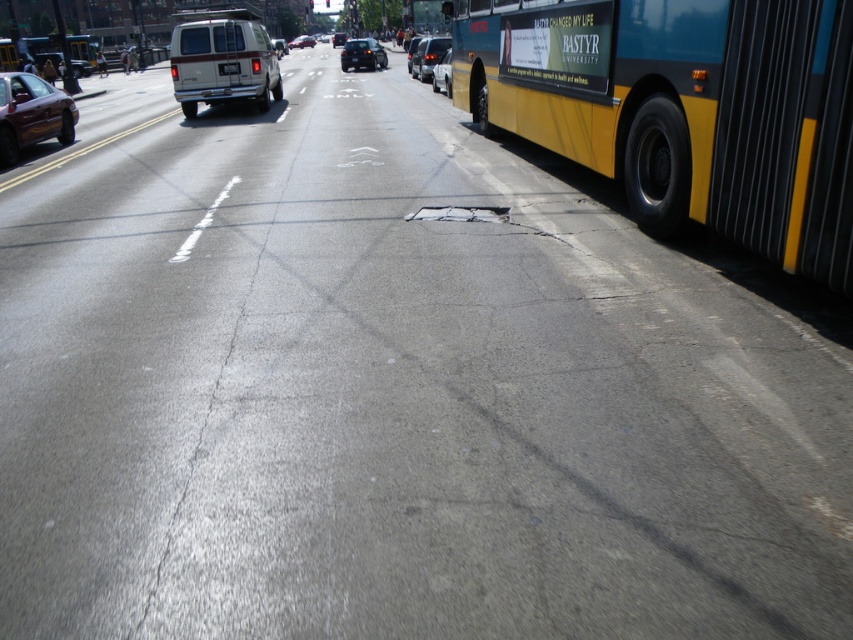
Question: Does yellow matte bus at upper left appear under shiny silver van at center?

Choices:
 (A) yes
 (B) no

Answer: (A)

Question: Which point is closer to the camera taking this photo?

Choices:
 (A) (369, 51)
 (B) (204, 83)

Answer: (B)

Question: Does shiny maroon sedan at left have a greater width compared to matte black sedan at center?

Choices:
 (A) no
 (B) yes

Answer: (A)

Question: Which point is closer to the camera?

Choices:
 (A) shiny silver sedan at center
 (B) shiny black sedan at center

Answer: (A)

Question: Which of the following is the closest to the observer?

Choices:
 (A) teal/yellow metal bus at right
 (B) shiny maroon sedan at left
 (C) yellow matte bus at upper left

Answer: (A)

Question: Can you confirm if shiny black sedan at center is positioned below white plastic license plate at center?

Choices:
 (A) yes
 (B) no

Answer: (B)